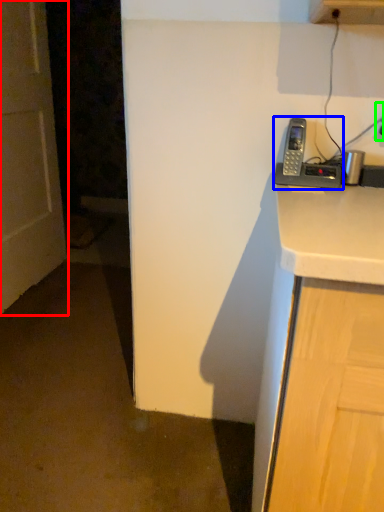
Question: Considering the real-world distances, which object is closest to door (highlighted by a red box)? corded phone (highlighted by a blue box) or electric outlet (highlighted by a green box).

Choices:
 (A) corded phone
 (B) electric outlet

Answer: (A)